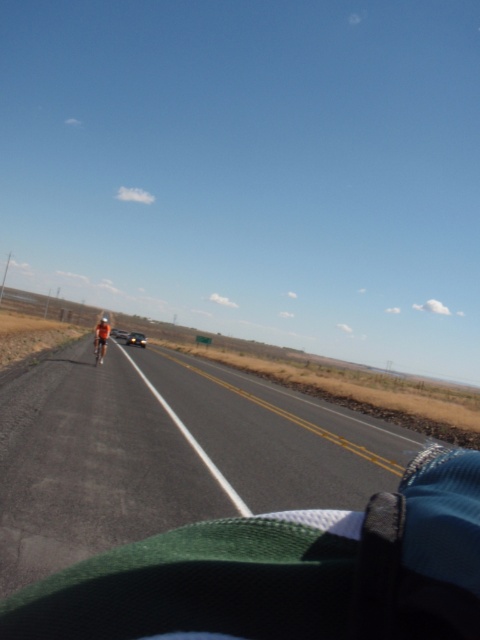
Question: Considering the real-world distances, which object is closest to the metallic silver car at center?

Choices:
 (A) orange fabric bicycle at center
 (B) asphalt road at center

Answer: (A)

Question: Is asphalt road at center below metallic silver car at center?

Choices:
 (A) no
 (B) yes

Answer: (B)

Question: Which point is closer to the camera taking this photo?

Choices:
 (A) (136, 337)
 (B) (280, 397)
 (C) (94, 342)

Answer: (B)

Question: Based on their relative distances, which object is farther from the asphalt road at center?

Choices:
 (A) metallic silver car at center
 (B) orange fabric bicycle at center

Answer: (A)

Question: Is asphalt road at center above metallic silver car at center?

Choices:
 (A) no
 (B) yes

Answer: (A)

Question: Does asphalt road at center lie behind orange fabric bicycle at center?

Choices:
 (A) yes
 (B) no

Answer: (B)